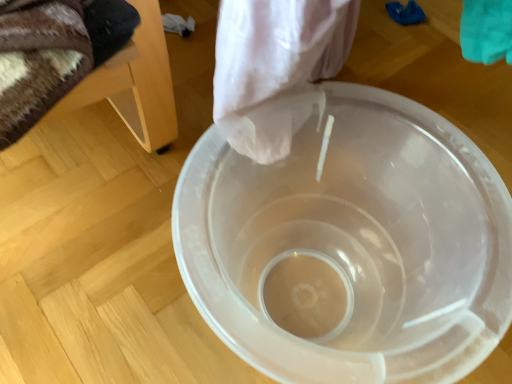
The image size is (512, 384). Describe the element at coordinates (355, 242) in the screenshot. I see `transparent plastic bucket at center` at that location.

In order to face transparent plastic bucket at center, should I rotate leftwards or rightwards?

You should rotate right by 9.026 degrees.

Locate an element on the screen. transparent plastic bucket at center is located at coordinates (355, 242).

What do you see at coordinates (81, 68) in the screenshot? I see `wooden chair at left` at bounding box center [81, 68].

What is the approximate height of wooden chair at left?

It is 9.85 inches.

The image size is (512, 384). I want to click on wooden chair at left, so click(x=81, y=68).

This screenshot has width=512, height=384. Identify the location of transparent plastic bucket at center. (355, 242).

Considering the positions of objects wooden chair at left and transparent plastic bucket at center in the image provided, who is more to the left, wooden chair at left or transparent plastic bucket at center?

wooden chair at left is more to the left.

In the image, is wooden chair at left positioned in front of or behind transparent plastic bucket at center?

Visually, wooden chair at left is located in front of transparent plastic bucket at center.

Considering the points (49, 106) and (426, 373), which point is behind, point (49, 106) or point (426, 373)?

Point (49, 106)

From the image's perspective, relative to transparent plastic bucket at center, is wooden chair at left above or below?

wooden chair at left is above transparent plastic bucket at center.

From a real-world perspective, is wooden chair at left physically located above or below transparent plastic bucket at center?

wooden chair at left is situated higher than transparent plastic bucket at center in the real world.

Between wooden chair at left and transparent plastic bucket at center, which one has smaller width?

wooden chair at left is thinner.

Between wooden chair at left and transparent plastic bucket at center, which one has less height?

wooden chair at left.

In terms of size, does wooden chair at left appear bigger or smaller than transparent plastic bucket at center?

wooden chair at left is smaller than transparent plastic bucket at center.

Which is correct: wooden chair at left is inside transparent plastic bucket at center, or outside of it?

wooden chair at left cannot be found inside transparent plastic bucket at center.

From the picture: Is wooden chair at left positioned far away from transparent plastic bucket at center?

They are positioned close to each other.

Is wooden chair at left facing towards transparent plastic bucket at center?

Yes, wooden chair at left faces towards transparent plastic bucket at center.

Where is `furniture to the left of transparent plastic bucket at center`? furniture to the left of transparent plastic bucket at center is located at coordinates (81, 68).

Between transparent plastic bucket at center and wooden chair at left, which one appears on the right side from the viewer's perspective?

Positioned to the right is transparent plastic bucket at center.

Is the depth of transparent plastic bucket at center less than that of wooden chair at left?

No, transparent plastic bucket at center is behind wooden chair at left.

Which is closer, (187, 160) or (131, 44)?

Clearly, point (187, 160) is more distant from the camera than point (131, 44).

From the image's perspective, between transparent plastic bucket at center and wooden chair at left, which one is located above?

wooden chair at left, from the image's perspective.

From a real-world perspective, is transparent plastic bucket at center physically located above or below wooden chair at left?

transparent plastic bucket at center is below wooden chair at left.

From the picture: Between transparent plastic bucket at center and wooden chair at left, which one has smaller width?

wooden chair at left is thinner.

Between transparent plastic bucket at center and wooden chair at left, which one has more height?

With more height is transparent plastic bucket at center.

Who is smaller, transparent plastic bucket at center or wooden chair at left?

wooden chair at left is smaller.

Is transparent plastic bucket at center completely or partially outside of wooden chair at left?

Yes, transparent plastic bucket at center is not within wooden chair at left.

Is transparent plastic bucket at center next to wooden chair at left and touching it?

No, transparent plastic bucket at center is not beside wooden chair at left.

Could you tell me if transparent plastic bucket at center is turned towards wooden chair at left?

No, transparent plastic bucket at center is not oriented towards wooden chair at left.

How different are the orientations of transparent plastic bucket at center and wooden chair at left in degrees?

transparent plastic bucket at center and wooden chair at left are facing 46.9 degrees away from each other.

You are a GUI agent. You are given a task and a screenshot of the screen. Output one action in this format:
    pyautogui.click(x=<x>, y=<y>)
    Task: Click on the toilet below the wooden chair at left (from the image's perspective)
    The image size is (512, 384).
    Given the screenshot: What is the action you would take?
    pyautogui.click(x=355, y=242)

Image resolution: width=512 pixels, height=384 pixels. Identify the location of furniture that appears above the transparent plastic bucket at center (from the image's perspective). (81, 68).

Where is `furniture on the left of the transparent plastic bucket at center`? This screenshot has width=512, height=384. furniture on the left of the transparent plastic bucket at center is located at coordinates (81, 68).